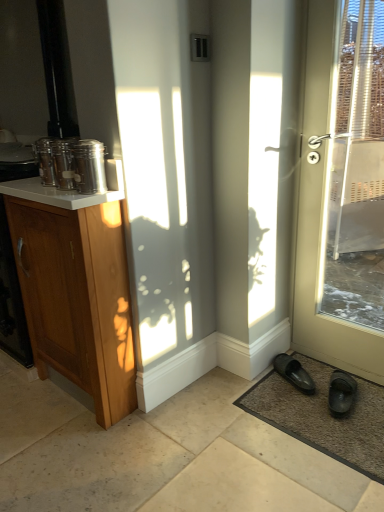
At what (x,y) coordinates should I click in order to perform the action: click on brushed metal canister at upper left. Please return your answer as a coordinate pair (x, y). Image resolution: width=384 pixels, height=512 pixels. Looking at the image, I should click on (89, 166).

At what (x,y) coordinates should I click in order to perform the action: click on black rubber slippers at lower right, which appears as the 1th footwear when viewed from the right. Please return your answer as a coordinate pair (x, y). This screenshot has width=384, height=512. Looking at the image, I should click on (341, 393).

Identify the location of white glossy counter top at upper left. The height and width of the screenshot is (512, 384). (68, 191).

At what (x,y) coordinates should I click in order to perform the action: click on black rubber slipper at lower right, the 1th footwear when ordered from left to right. Please return your answer as a coordinate pair (x, y). This screenshot has width=384, height=512. Looking at the image, I should click on (294, 373).

The height and width of the screenshot is (512, 384). Describe the element at coordinates (323, 220) in the screenshot. I see `matte white door at right` at that location.

At what (x,y) coordinates should I click in order to perform the action: click on brushed metal canister at upper left. Please return your answer as a coordinate pair (x, y). Looking at the image, I should click on (89, 166).

Are brushed metal canister at upper left and black rubber slippers at lower right, marked as the second footwear in a left-to-right arrangement, far apart?

Yes, brushed metal canister at upper left and black rubber slippers at lower right, marked as the second footwear in a left-to-right arrangement, are quite far apart.

Which of these two, brushed metal canister at upper left or black rubber slippers at lower right, which appears as the 1th footwear when viewed from the right, is wider?

black rubber slippers at lower right, which appears as the 1th footwear when viewed from the right.

Does brushed metal canister at upper left turn towards black rubber slippers at lower right, marked as the second footwear in a left-to-right arrangement?

No, brushed metal canister at upper left is not aimed at black rubber slippers at lower right, marked as the second footwear in a left-to-right arrangement.

From their relative heights in the image, would you say brushed metal canister at upper left is taller or shorter than black rubber slippers at lower right, marked as the second footwear in a left-to-right arrangement?

brushed metal canister at upper left is taller than black rubber slippers at lower right, marked as the second footwear in a left-to-right arrangement.

From a real-world perspective, is white glossy counter top at upper left located higher than wooden cabinet at left?

Yes, from a real-world perspective, white glossy counter top at upper left is above wooden cabinet at left.

Image resolution: width=384 pixels, height=512 pixels. What are the coordinates of `counter top that is above the wooden cabinet at left (from a real-world perspective)` in the screenshot? It's located at (68, 191).

Is white glossy counter top at upper left in contact with wooden cabinet at left?

No, white glossy counter top at upper left is not beside wooden cabinet at left.

Is white glossy counter top at upper left bigger or smaller than wooden cabinet at left?

Clearly, white glossy counter top at upper left is smaller in size than wooden cabinet at left.

Considering the sizes of white glossy counter top at upper left and matte white door at right in the image, is white glossy counter top at upper left taller or shorter than matte white door at right?

Considering their sizes, white glossy counter top at upper left has less height than matte white door at right.

Which object is further away from the camera, white glossy counter top at upper left or matte white door at right?

Positioned behind is white glossy counter top at upper left.

Between white glossy counter top at upper left and matte white door at right, which one has larger size?

matte white door at right.

Is white glossy counter top at upper left looking in the opposite direction of matte white door at right?

No.

Considering the sizes of objects brushed metal canister at upper left and black rubber slipper at lower right, the second footwear viewed from the right, in the image provided, who is thinner, brushed metal canister at upper left or black rubber slipper at lower right, the second footwear viewed from the right,?

brushed metal canister at upper left.

From a real-world perspective, which object stands above the other?

brushed metal canister at upper left, from a real-world perspective.

Is the surface of brushed metal canister at upper left in direct contact with black rubber slipper at lower right, the 1th footwear when ordered from left to right?

brushed metal canister at upper left and black rubber slipper at lower right, the 1th footwear when ordered from left to right, are not in contact.

Can you confirm if black rubber slipper at lower right, the second footwear viewed from the right, is positioned to the right of brushed metal canister at upper left?

Indeed, black rubber slipper at lower right, the second footwear viewed from the right, is positioned on the right side of brushed metal canister at upper left.

Do you think black rubber slipper at lower right, the second footwear viewed from the right, is within brushed metal canister at upper left, or outside of it?

black rubber slipper at lower right, the second footwear viewed from the right, is not inside brushed metal canister at upper left, it's outside.

Could you measure the distance between black rubber slipper at lower right, the 1th footwear when ordered from left to right, and brushed metal canister at upper left?

black rubber slipper at lower right, the 1th footwear when ordered from left to right, and brushed metal canister at upper left are 1.18 meters apart from each other.

This screenshot has width=384, height=512. Find the location of `glass jar in front of the black rubber slipper at lower right, the 1th footwear when ordered from left to right`. glass jar in front of the black rubber slipper at lower right, the 1th footwear when ordered from left to right is located at coordinates (89, 166).

Consider the image. Which object is wider, brown textured mat at lower right or white glossy counter top at upper left?

brown textured mat at lower right is wider.

How distant is brown textured mat at lower right from white glossy counter top at upper left?

3.68 feet.

Considering their positions, is brown textured mat at lower right located in front of or behind white glossy counter top at upper left?

brown textured mat at lower right is positioned farther from the viewer than white glossy counter top at upper left.

Considering the points (292, 403) and (100, 201), which point is in front, point (292, 403) or point (100, 201)?

The point (100, 201) is more forward.

In the image, is wooden cabinet at left on the left side or the right side of black rubber slippers at lower right, which appears as the 1th footwear when viewed from the right?

Clearly, wooden cabinet at left is on the left of black rubber slippers at lower right, which appears as the 1th footwear when viewed from the right, in the image.

From the picture: Is wooden cabinet at left thinner than black rubber slippers at lower right, marked as the second footwear in a left-to-right arrangement?

No.

Is wooden cabinet at left looking in the opposite direction of black rubber slippers at lower right, marked as the second footwear in a left-to-right arrangement?

No, wooden cabinet at left's orientation is not away from black rubber slippers at lower right, marked as the second footwear in a left-to-right arrangement.

Considering the relative sizes of wooden cabinet at left and black rubber slippers at lower right, marked as the second footwear in a left-to-right arrangement, in the image provided, is wooden cabinet at left bigger than black rubber slippers at lower right, marked as the second footwear in a left-to-right arrangement,?

Yes.

At what (x,y) coordinates should I click in order to perform the action: click on glass jar above the black rubber slippers at lower right, which appears as the 1th footwear when viewed from the right (from a real-world perspective). Please return your answer as a coordinate pair (x, y). This screenshot has height=512, width=384. Looking at the image, I should click on (89, 166).

Where is `counter top above the wooden cabinet at left (from the image's perspective)`? The height and width of the screenshot is (512, 384). counter top above the wooden cabinet at left (from the image's perspective) is located at coordinates (68, 191).

Looking at this image, when comparing their distances from black rubber slippers at lower right, marked as the second footwear in a left-to-right arrangement, does black rubber slipper at lower right, the second footwear viewed from the right, or brushed metal canister at upper left seem further?

The object further to black rubber slippers at lower right, marked as the second footwear in a left-to-right arrangement, is brushed metal canister at upper left.

Which object lies nearer to the anchor point matte white door at right, black rubber slippers at lower right, which appears as the 1th footwear when viewed from the right, or black rubber slipper at lower right, the second footwear viewed from the right?

black rubber slippers at lower right, which appears as the 1th footwear when viewed from the right.

Estimate the real-world distances between objects in this image. Which object is closer to matte white door at right, white glossy counter top at upper left or brown textured mat at lower right?

Based on the image, brown textured mat at lower right appears to be nearer to matte white door at right.

Based on their spatial positions, is black rubber slippers at lower right, which appears as the 1th footwear when viewed from the right, or black rubber slipper at lower right, the second footwear viewed from the right, closer to white glossy counter top at upper left?

The object closer to white glossy counter top at upper left is black rubber slipper at lower right, the second footwear viewed from the right.

From the image, which object appears to be nearer to brushed metal canister at upper left, wooden cabinet at left or black rubber slipper at lower right, the second footwear viewed from the right?

wooden cabinet at left.

Based on their spatial positions, is matte white door at right or brown textured mat at lower right closer to black rubber slipper at lower right, the 1th footwear when ordered from left to right?

Among the two, brown textured mat at lower right is located nearer to black rubber slipper at lower right, the 1th footwear when ordered from left to right.

Looking at the image, which one is located closer to white glossy counter top at upper left, wooden cabinet at left or matte white door at right?

wooden cabinet at left is closer to white glossy counter top at upper left.

Looking at the image, which one is located further to white glossy counter top at upper left, black rubber slippers at lower right, which appears as the 1th footwear when viewed from the right, or matte white door at right?

The object further to white glossy counter top at upper left is black rubber slippers at lower right, which appears as the 1th footwear when viewed from the right.

This screenshot has height=512, width=384. Identify the location of doormat between white glossy counter top at upper left and black rubber slippers at lower right, marked as the second footwear in a left-to-right arrangement, in the horizontal direction. (324, 416).

Find the location of a particular element. footwear between brushed metal canister at upper left and black rubber slippers at lower right, which appears as the 1th footwear when viewed from the right, in the horizontal direction is located at coordinates (294, 373).

Locate an element on the screen. Image resolution: width=384 pixels, height=512 pixels. doormat located between brushed metal canister at upper left and matte white door at right in the left-right direction is located at coordinates (324, 416).

At what (x,y) coordinates should I click in order to perform the action: click on footwear between brushed metal canister at upper left and brown textured mat at lower right from left to right. Please return your answer as a coordinate pair (x, y). The image size is (384, 512). Looking at the image, I should click on (294, 373).